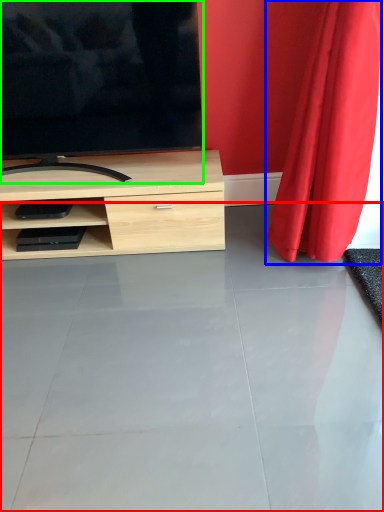
Question: Considering the real-world distances, which object is farthest from concrete (highlighted by a red box)? curtain (highlighted by a blue box) or television (highlighted by a green box)?

Choices:
 (A) curtain
 (B) television

Answer: (B)